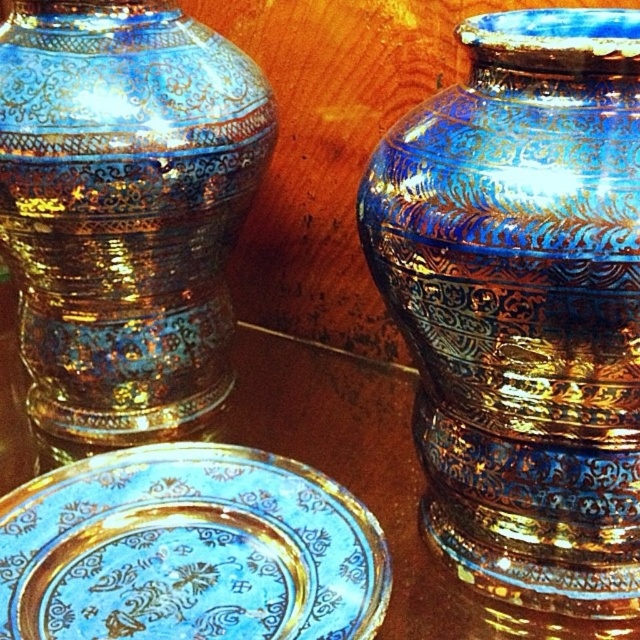
Does blue-golden metallic vase at left appear over blue glossy plate at center?

Correct, blue-golden metallic vase at left is located above blue glossy plate at center.

The image size is (640, 640). Describe the element at coordinates (124, 208) in the screenshot. I see `blue-golden metallic vase at left` at that location.

Image resolution: width=640 pixels, height=640 pixels. I want to click on blue-golden metallic vase at left, so coord(124,208).

Does blue-golden metallic vase at right appear on the left side of blue-golden metallic vase at left?

No, blue-golden metallic vase at right is not to the left of blue-golden metallic vase at left.

In the scene shown: Who is more distant from viewer, (609, 372) or (164, 220)?

The point (164, 220) is more distant.

Who is more forward, (580, 392) or (81, 394)?

Point (580, 392) is in front.

Locate an element on the screen. Image resolution: width=640 pixels, height=640 pixels. blue-golden metallic vase at right is located at coordinates (524, 304).

Does blue-golden metallic vase at left appear on the right side of blue glossy platter at center?

Incorrect, blue-golden metallic vase at left is not on the right side of blue glossy platter at center.

Is point (224, 125) positioned behind point (253, 572)?

Yes.

Who is more forward, (109, 193) or (154, 547)?

Positioned in front is point (154, 547).

The height and width of the screenshot is (640, 640). In order to click on blue-golden metallic vase at left in this screenshot , I will do `click(124, 208)`.